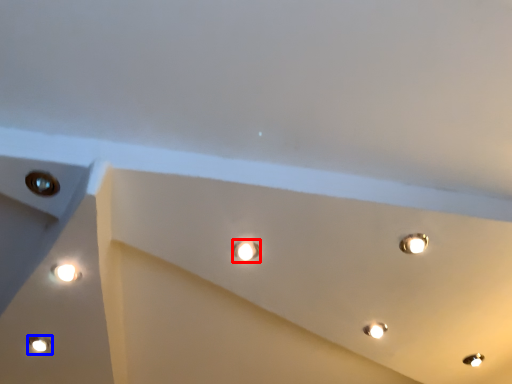
Question: Which object is further to the camera taking this photo, droplight (highlighted by a red box) or lamp (highlighted by a blue box)?

Choices:
 (A) droplight
 (B) lamp

Answer: (B)